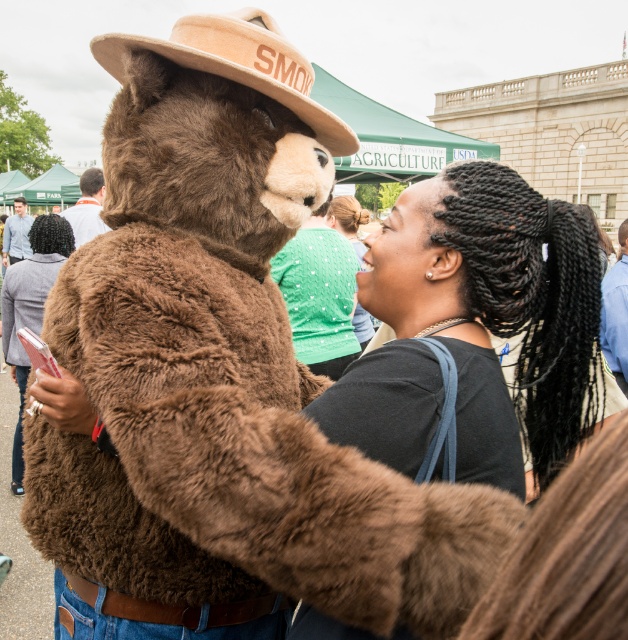
Can you confirm if black matte hair at upper right is taller than beige felt hat at upper center?

Yes, black matte hair at upper right is taller than beige felt hat at upper center.

The height and width of the screenshot is (640, 628). What do you see at coordinates (477, 328) in the screenshot?
I see `black matte hair at upper right` at bounding box center [477, 328].

Locate an element on the screen. This screenshot has width=628, height=640. black matte hair at upper right is located at coordinates (477, 328).

In order to click on black matte hair at upper right in this screenshot , I will do `click(477, 328)`.